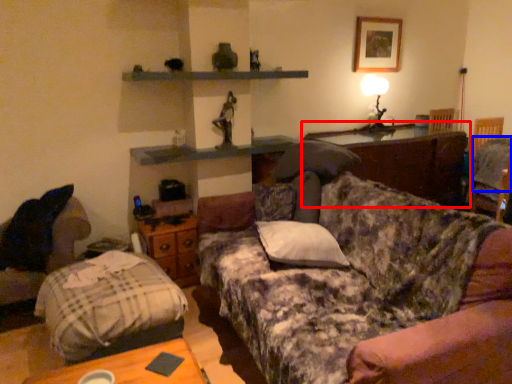
Question: Which point is closer to the camera, table (highlighted by a red box) or pillow (highlighted by a blue box)?

Choices:
 (A) table
 (B) pillow

Answer: (B)